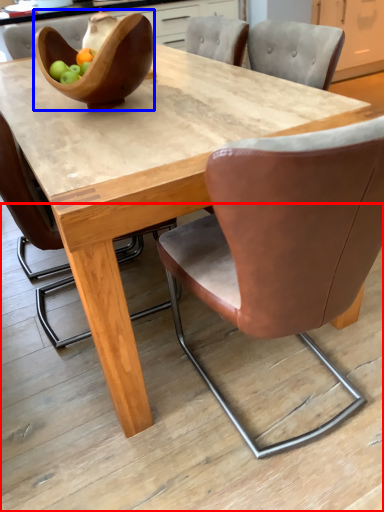
Question: Among these objects, which one is farthest to the camera, concrete (highlighted by a red box) or bowl (highlighted by a blue box)?

Choices:
 (A) concrete
 (B) bowl

Answer: (B)